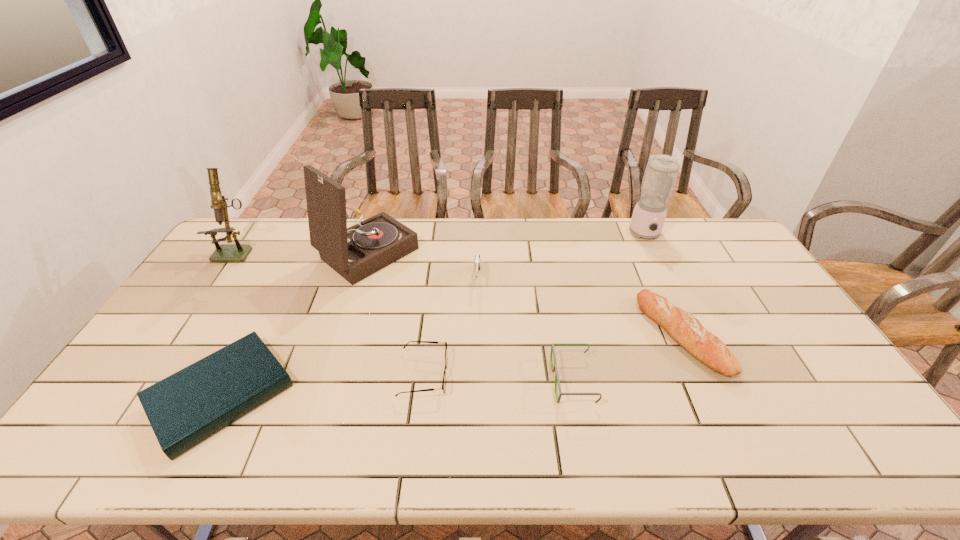
Image resolution: width=960 pixels, height=540 pixels. What are the coordinates of `phonograph record` in the screenshot? It's located at (355, 253).

Where is `food processor`? This screenshot has height=540, width=960. food processor is located at coordinates (661, 172).

Identify the location of microscope. (237, 252).

Locate an element on the screen. Image resolution: width=960 pixels, height=540 pixels. gun is located at coordinates (477, 260).

You are a GUI agent. You are given a task and a screenshot of the screen. Output one action in this format:
    pyautogui.click(x=<x>, y=<y>)
    Task: Click on the fourth tallest object
    The image size is (960, 540).
    Given the screenshot: What is the action you would take?
    pyautogui.click(x=477, y=260)

You are a GUI agent. You are given a task and a screenshot of the screen. Output one action in this format:
    pyautogui.click(x=<x>, y=<y>)
    Task: Click on the fourth shortest object
    The width and height of the screenshot is (960, 540).
    Given the screenshot: What is the action you would take?
    pyautogui.click(x=681, y=326)

In order to click on the third object from right to left in this screenshot , I will do `click(554, 369)`.

Locate an element on the screen. The height and width of the screenshot is (540, 960). the left spectacles is located at coordinates (435, 342).

The image size is (960, 540). I want to click on book, so 184,409.

Locate an element on the screen. vacant space situated 0.130m on the front of the phonograph record is located at coordinates (348, 317).